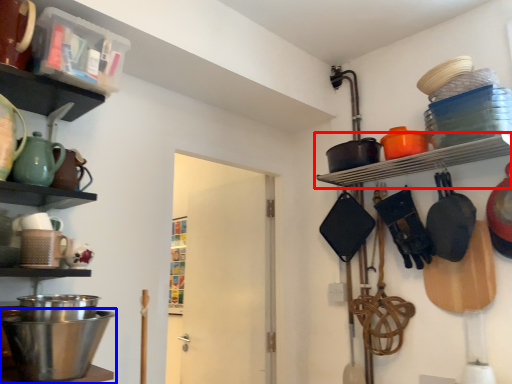
Question: Which of the following is the farthest to the observer, shelf (highlighted by a red box) or mixing bowl (highlighted by a blue box)?

Choices:
 (A) shelf
 (B) mixing bowl

Answer: (A)